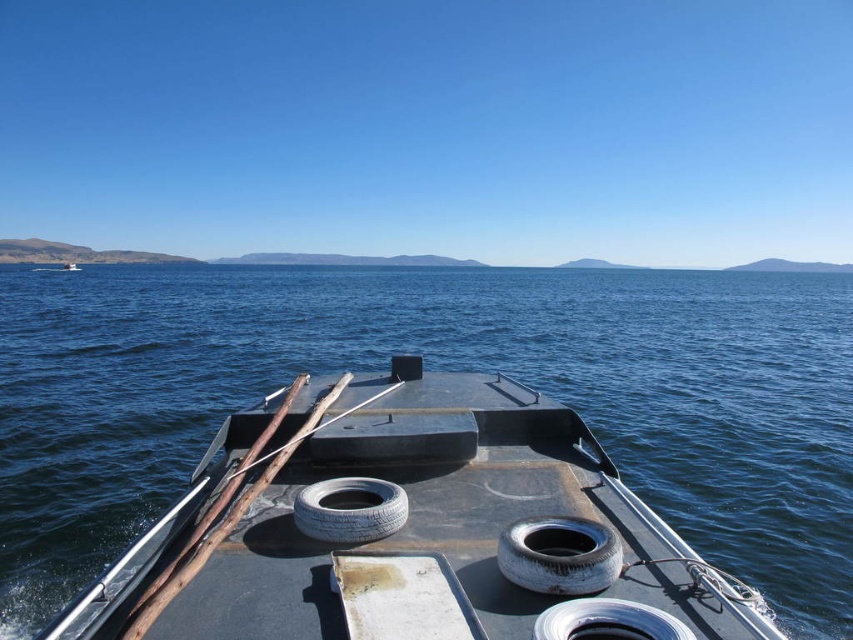
You are standing on the deck of the boat and notice two tires at the center. Which tire is closer to the water surface, the worn rubber tire at center or the white rubber tire at center?

The worn rubber tire at center is closer to the water surface because it is positioned below the white rubber tire at center.